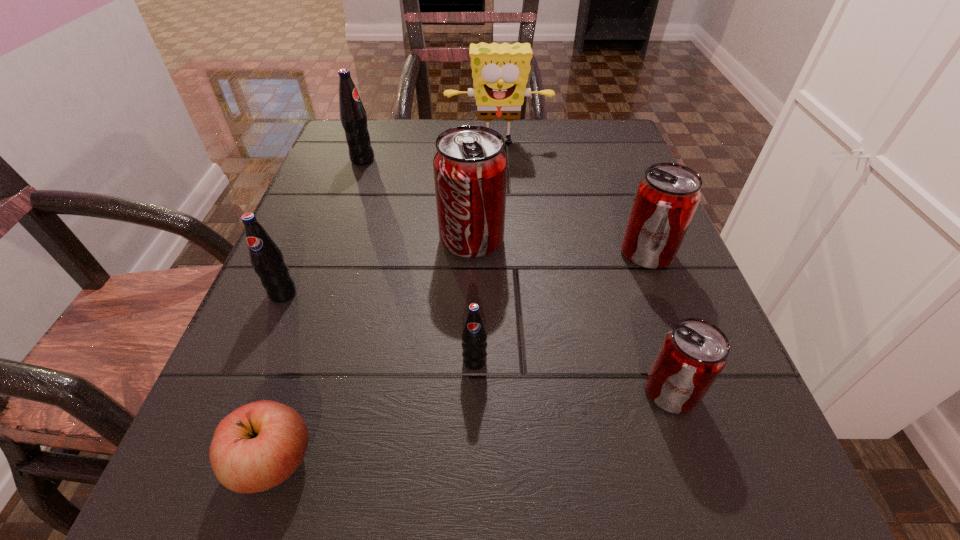
I want to click on sponge situated at the far edge, so click(x=500, y=72).

Where is `pop situated at the far edge`? This screenshot has width=960, height=540. pop situated at the far edge is located at coordinates (353, 117).

The width and height of the screenshot is (960, 540). What are the coordinates of `object located at the near edge` in the screenshot? It's located at (259, 445).

Image resolution: width=960 pixels, height=540 pixels. Find the location of `apple that is at the left edge`. apple that is at the left edge is located at coordinates (259, 445).

Identify the location of object located in the far left corner section of the desktop. (353, 117).

Locate an element on the screen. object at the near left corner is located at coordinates (259, 445).

In the image, there is a desktop. At what (x,y) coordinates should I click in order to perform the action: click on vacant space at the far edge. Please return your answer as a coordinate pair (x, y). The height and width of the screenshot is (540, 960). Looking at the image, I should click on (525, 145).

Identify the location of vacant space at the near edge of the desktop. (404, 504).

Identify the location of vacant space at the left edge. The width and height of the screenshot is (960, 540). (319, 404).

You are a GUI agent. You are given a task and a screenshot of the screen. Output one action in this format:
    pyautogui.click(x=<x>, y=<y>)
    Task: Click on the free region at the right edge
    
    Given the screenshot: What is the action you would take?
    pyautogui.click(x=614, y=210)